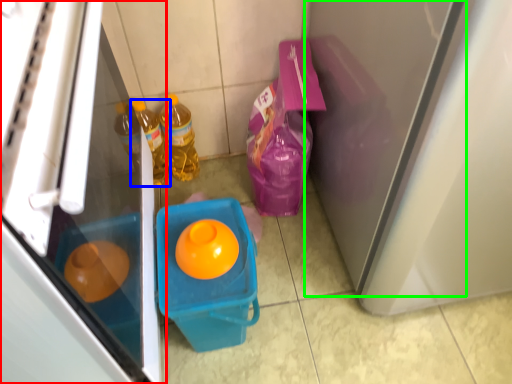
Question: Which is nearer to the refrigerator (highlighted by a red box)? bottle (highlighted by a blue box) or screen door (highlighted by a green box).

Choices:
 (A) bottle
 (B) screen door

Answer: (B)